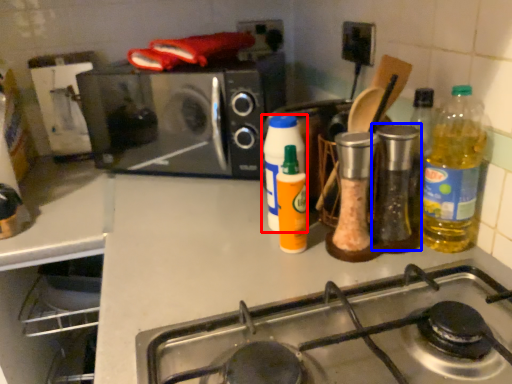
Question: Which of the following is the closest to the observer, bottle (highlighted by a red box) or bottle (highlighted by a blue box)?

Choices:
 (A) bottle
 (B) bottle

Answer: (B)